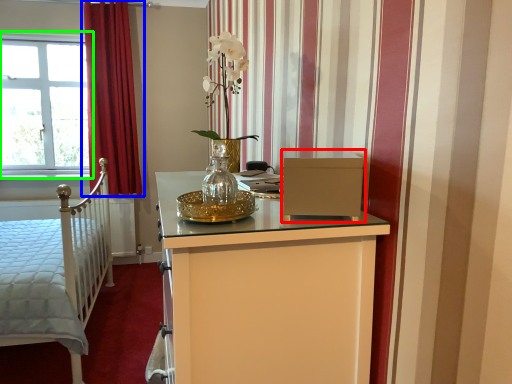
Question: Which object is the closest to the file cabinet (highlighted by a red box)? Choose among these: curtain (highlighted by a blue box) or window (highlighted by a green box).

Choices:
 (A) curtain
 (B) window

Answer: (A)